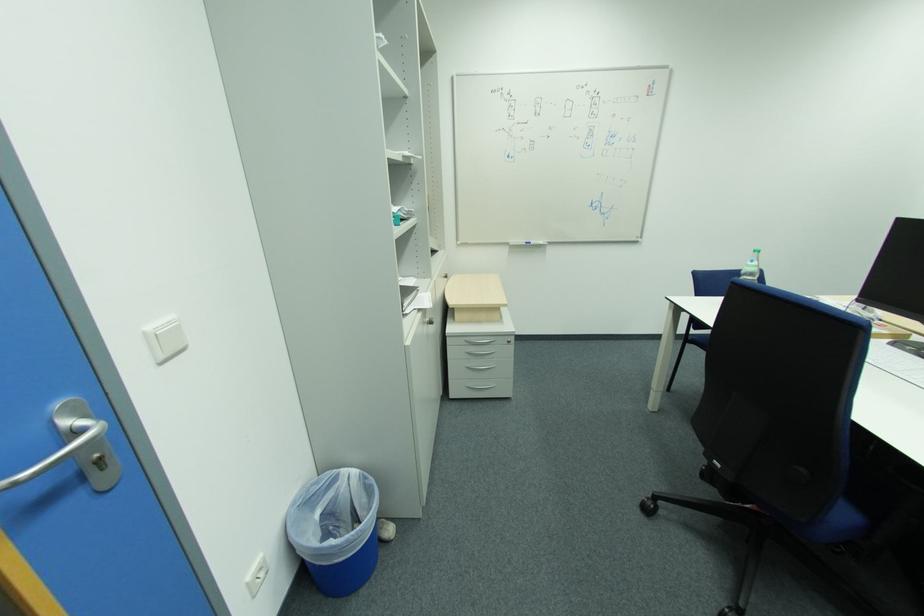
Locate an element on the screen. blue trash can is located at coordinates (335, 530).